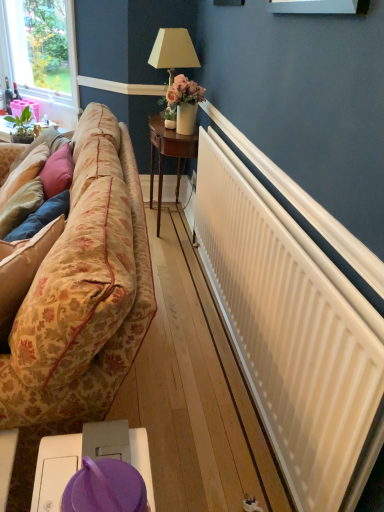
Question: Does white matte radiator at right have a lesser width compared to floral fabric couch at left?

Choices:
 (A) no
 (B) yes

Answer: (B)

Question: From the image's perspective, is white matte radiator at right on floral fabric couch at left?

Choices:
 (A) yes
 (B) no

Answer: (B)

Question: Is white matte radiator at right positioned before floral fabric couch at left?

Choices:
 (A) no
 (B) yes

Answer: (A)

Question: Is white matte radiator at right shorter than floral fabric couch at left?

Choices:
 (A) no
 (B) yes

Answer: (B)

Question: Considering the relative positions of white matte radiator at right and floral fabric couch at left in the image provided, is white matte radiator at right to the right of floral fabric couch at left from the viewer's perspective?

Choices:
 (A) no
 (B) yes

Answer: (B)

Question: From the image's perspective, is white matte radiator at right located above or below purple fabric at lower center, placed as the first table when sorted from right to left?

Choices:
 (A) above
 (B) below

Answer: (A)

Question: In the image, is white matte radiator at right on the left side or the right side of purple fabric at lower center, placed as the first table when sorted from right to left?

Choices:
 (A) left
 (B) right

Answer: (B)

Question: In terms of width, does white matte radiator at right look wider or thinner when compared to purple fabric at lower center, the first table positioned from the front?

Choices:
 (A) wide
 (B) thin

Answer: (B)

Question: Is point (271, 227) closer or farther from the camera than point (72, 455)?

Choices:
 (A) farther
 (B) closer

Answer: (A)

Question: From a real-world perspective, is matte pink plastic at left, the 1th table when ordered from top to bottom, physically located above or below floral fabric couch at left?

Choices:
 (A) below
 (B) above

Answer: (B)

Question: From the image's perspective, is matte pink plastic at left, placed as the 3th table when sorted from right to left, positioned above or below floral fabric couch at left?

Choices:
 (A) below
 (B) above

Answer: (B)

Question: Looking at their shapes, would you say matte pink plastic at left, the 1th table when ordered from top to bottom, is wider or thinner than floral fabric couch at left?

Choices:
 (A) wide
 (B) thin

Answer: (B)

Question: Considering the positions of matte pink plastic at left, the 1th table when ordered from top to bottom, and floral fabric couch at left in the image, is matte pink plastic at left, the 1th table when ordered from top to bottom, taller or shorter than floral fabric couch at left?

Choices:
 (A) short
 (B) tall

Answer: (A)

Question: Based on their sizes in the image, would you say clear glass window at upper left is bigger or smaller than white matte radiator at right?

Choices:
 (A) big
 (B) small

Answer: (B)

Question: Considering the positions of point (67, 14) and point (249, 380), is point (67, 14) closer or farther from the camera than point (249, 380)?

Choices:
 (A) farther
 (B) closer

Answer: (A)